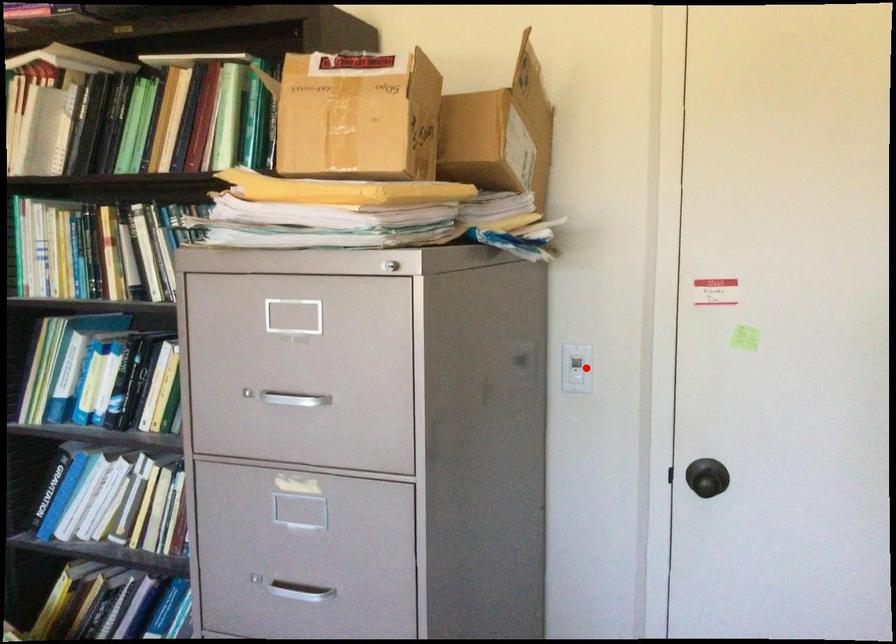
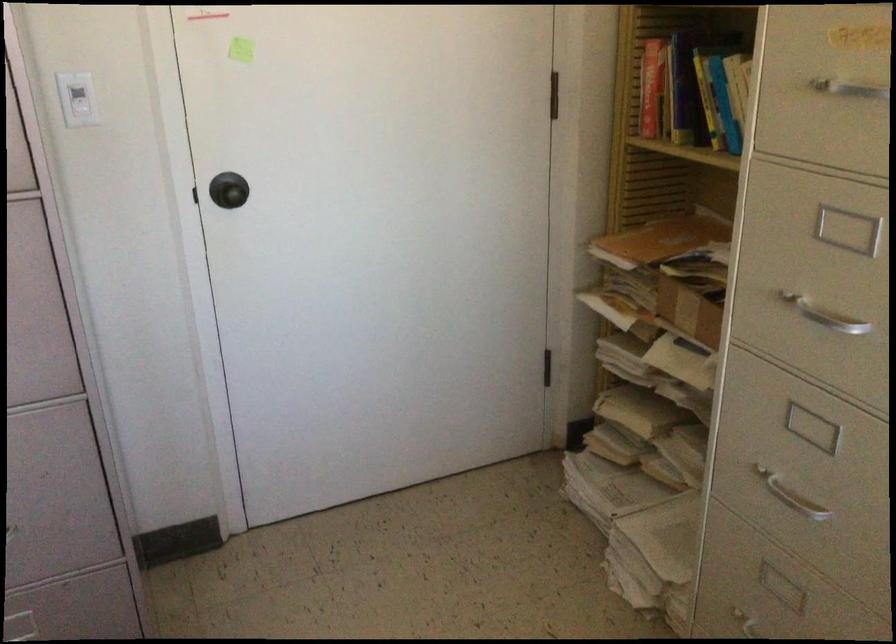
The point at the highlighted location is marked in the first image. Where is the corresponding point in the second image?

(76, 99)